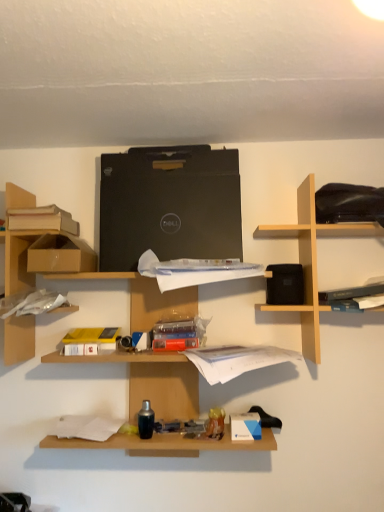
Question: Is matte cardboard book at upper left, marked as the third book in a bottom-to-top arrangement, positioned with its back to white paper at center, positioned as the 1th book in bottom-to-top order?

Choices:
 (A) no
 (B) yes

Answer: (A)

Question: Can you confirm if matte cardboard book at upper left, arranged as the first book when viewed from the top, is positioned to the left of white paper at center, the 3th book in the top-to-bottom sequence?

Choices:
 (A) no
 (B) yes

Answer: (B)

Question: Considering the relative sizes of matte cardboard book at upper left, arranged as the first book when viewed from the top, and white paper at center, the 3th book in the top-to-bottom sequence, in the image provided, is matte cardboard book at upper left, arranged as the first book when viewed from the top, thinner than white paper at center, the 3th book in the top-to-bottom sequence,?

Choices:
 (A) yes
 (B) no

Answer: (A)

Question: Is matte cardboard book at upper left, the 1th book from the left, directly adjacent to white paper at center, the second book positioned from the right?

Choices:
 (A) yes
 (B) no

Answer: (B)

Question: Is matte cardboard book at upper left, arranged as the first book when viewed from the top, smaller than white paper at center, the second book positioned from the right?

Choices:
 (A) yes
 (B) no

Answer: (A)

Question: Is the depth of matte cardboard book at upper left, marked as the third book in a bottom-to-top arrangement, greater than that of white paper at center, positioned as the 1th book in bottom-to-top order?

Choices:
 (A) no
 (B) yes

Answer: (B)

Question: From a real-world perspective, is white paper at center, the 3th book in the top-to-bottom sequence, below matte cardboard book at upper left, marked as the third book in a bottom-to-top arrangement?

Choices:
 (A) yes
 (B) no

Answer: (A)

Question: Is white paper at center, which is counted as the second book, starting from the left, outside matte cardboard book at upper left, the 3th book positioned from the right?

Choices:
 (A) no
 (B) yes

Answer: (B)

Question: Can you confirm if white paper at center, which is counted as the second book, starting from the left, is positioned to the right of matte cardboard book at upper left, the 1th book from the left?

Choices:
 (A) no
 (B) yes

Answer: (B)

Question: Can you confirm if white paper at center, which is counted as the second book, starting from the left, is thinner than matte cardboard book at upper left, marked as the third book in a bottom-to-top arrangement?

Choices:
 (A) no
 (B) yes

Answer: (A)

Question: Can you confirm if white paper at center, which is counted as the second book, starting from the left, is taller than matte cardboard book at upper left, marked as the third book in a bottom-to-top arrangement?

Choices:
 (A) yes
 (B) no

Answer: (A)

Question: Does white paper at center, which is counted as the second book, starting from the left, come behind matte cardboard book at upper left, marked as the third book in a bottom-to-top arrangement?

Choices:
 (A) no
 (B) yes

Answer: (A)

Question: Is white paper at center, the 3th book in the top-to-bottom sequence, at the left side of brown cardboard box at left?

Choices:
 (A) yes
 (B) no

Answer: (B)